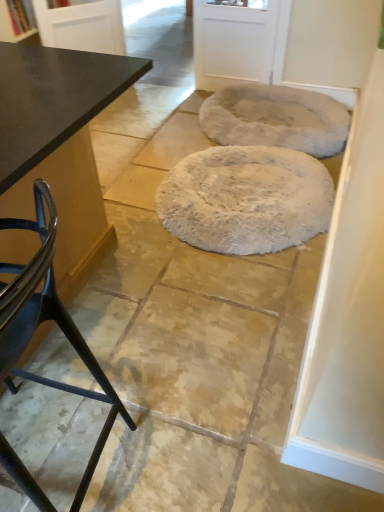
Question: Is matte black chair at left bigger or smaller than glossy black table at upper left, arranged as the first screen door when viewed from the left?

Choices:
 (A) big
 (B) small

Answer: (A)

Question: Considering the positions of matte black chair at left and glossy black table at upper left, the 2th screen door from the right, in the image, is matte black chair at left wider or thinner than glossy black table at upper left, the 2th screen door from the right,?

Choices:
 (A) wide
 (B) thin

Answer: (A)

Question: Based on their relative distances, which object is nearer to the glossy black table at upper left, the 2th screen door from the right?

Choices:
 (A) matte black chair at left
 (B) white matte screen door at upper center, arranged as the first screen door when viewed from the right
 (C) black matte table at left
 (D) fuzzy gray mat at upper right, arranged as the 2th mat when viewed from the front
 (E) white fluffy rug at center, acting as the second mat starting from the back

Answer: (B)

Question: Which object is the farthest from the black matte table at left?

Choices:
 (A) matte black chair at left
 (B) fuzzy gray mat at upper right, arranged as the 2th mat when viewed from the front
 (C) glossy black table at upper left, arranged as the first screen door when viewed from the left
 (D) white fluffy rug at center, the 1th mat when ordered from front to back
 (E) white matte screen door at upper center, arranged as the first screen door when viewed from the right

Answer: (E)